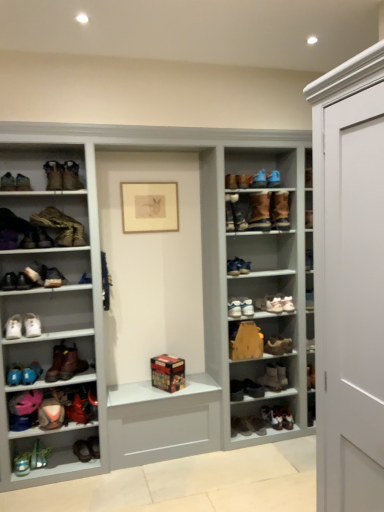
Question: Considering the positions of point (61, 237) and point (286, 345), is point (61, 237) closer or farther from the camera than point (286, 345)?

Choices:
 (A) farther
 (B) closer

Answer: (B)

Question: From a real-world perspective, is leather boot at left, the 4th footwear positioned from the top, above or below brown suede boot at center-right, the eleventh footwear positioned from the bottom?

Choices:
 (A) below
 (B) above

Answer: (B)

Question: Which object is the farthest from the matte gray shoe rack at center?

Choices:
 (A) brown suede boot at upper left, arranged as the 20th footwear when ordered from the bottom
 (B) leather boot at lower center, which is counted as the 5th shoe, starting from the right
 (C) wooden box at center
 (D) brown suede boots at upper center, marked as the third footwear in a top-to-bottom arrangement
 (E) matte black shoe at left, positioned as the 7th footwear in top-to-bottom order

Answer: (B)

Question: Which object is positioned closest to the matte black shoe at left, the ninth shoe when ordered from right to left?

Choices:
 (A) blue suede shoes at upper center, placed as the sixteenth footwear when sorted from bottom to top
 (B) brown leather boot at left, the 15th footwear positioned from the bottom
 (C) brown suede boot at upper center, which is counted as the 2th shoe, starting from the top
 (D) white leather shoe at lower left, the 13th footwear from the bottom
 (E) matte gray shoe rack at center

Answer: (B)